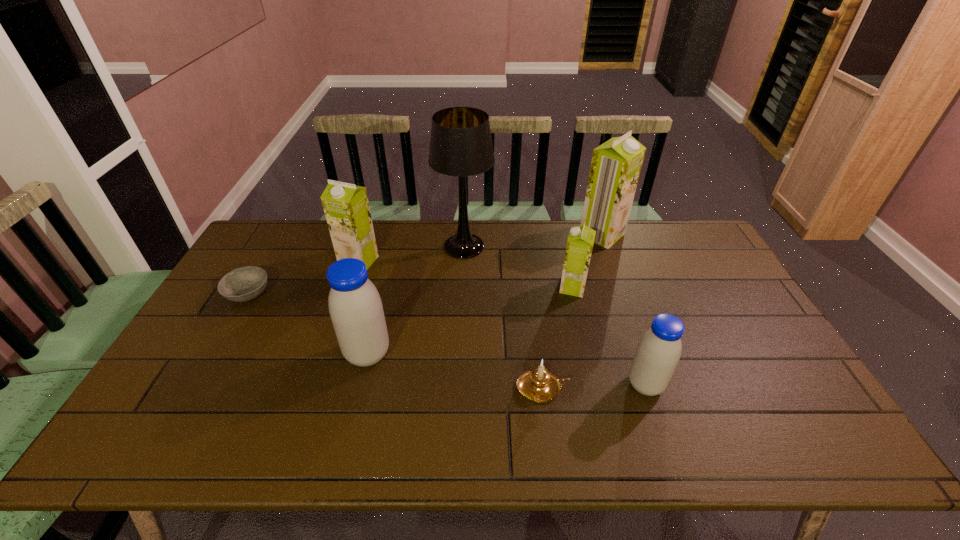
This screenshot has width=960, height=540. Identify the location of green soya milk identified as the third closest to the shortest object. (616, 164).

Locate an element on the screen. The image size is (960, 540). free region that satisfies the following two spatial constraints: 1. on the back side of the tallest object; 2. on the left side of the leftmost green soya milk is located at coordinates (364, 247).

This screenshot has width=960, height=540. In order to click on vacant space that satisfies the following two spatial constraints: 1. on the back side of the left blue soya milk; 2. on the right side of the farthest soya milk in this screenshot , I will do `click(396, 235)`.

Locate an element on the screen. vacant region that satisfies the following two spatial constraints: 1. on the front side of the second nearest green soya milk; 2. on the left side of the second green soya milk from left to right is located at coordinates (350, 288).

This screenshot has height=540, width=960. I want to click on vacant space that satisfies the following two spatial constraints: 1. on the back side of the table lamp; 2. on the left side of the farthest green soya milk, so click(x=465, y=235).

You are a GUI agent. You are given a task and a screenshot of the screen. Output one action in this format:
    pyautogui.click(x=<x>, y=<y>)
    Task: Click on the vacant point that satisfies the following two spatial constraints: 1. on the front side of the third farthest soya milk; 2. on the left side of the second farthest soya milk
    The image size is (960, 540).
    Given the screenshot: What is the action you would take?
    pyautogui.click(x=350, y=288)